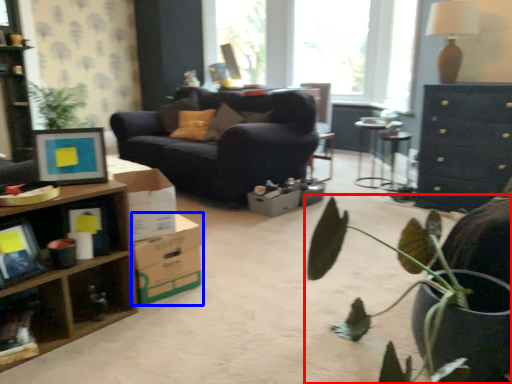
Question: Among these objects, which one is farthest to the camera, houseplant (highlighted by a red box) or cardboard box (highlighted by a blue box)?

Choices:
 (A) houseplant
 (B) cardboard box

Answer: (B)